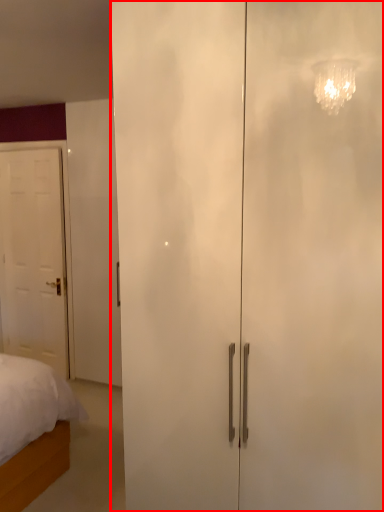
Question: Observing the image, what is the correct spatial positioning of door (annotated by the red box) in reference to door?

Choices:
 (A) left
 (B) right

Answer: (B)